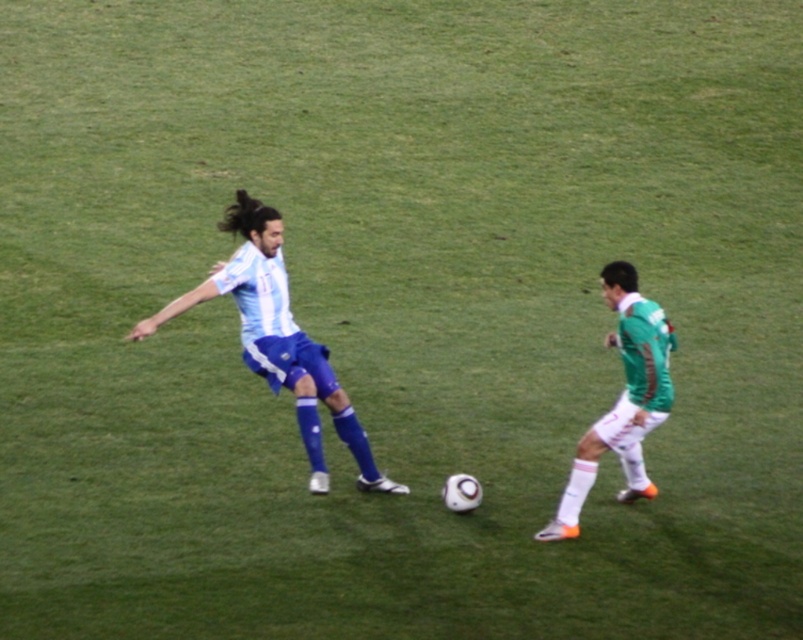
Does white matte soccer ball at center come in front of green matte jersey at right?

No, it is behind green matte jersey at right.

Who is positioned more to the right, white matte soccer ball at center or green matte jersey at right?

Positioned to the right is green matte jersey at right.

What do you see at coordinates (276, 336) in the screenshot? The height and width of the screenshot is (640, 803). I see `white matte soccer ball at center` at bounding box center [276, 336].

You are a GUI agent. You are given a task and a screenshot of the screen. Output one action in this format:
    pyautogui.click(x=<x>, y=<y>)
    Task: Click on the white matte soccer ball at center
    
    Given the screenshot: What is the action you would take?
    pyautogui.click(x=276, y=336)

Which is more to the left, white matte jersey at center or green matte jersey at right?

Positioned to the left is white matte jersey at center.

Where is `white matte jersey at center`? This screenshot has height=640, width=803. white matte jersey at center is located at coordinates (278, 339).

Find the location of `white matte jersey at center`. white matte jersey at center is located at coordinates (278, 339).

Who is positioned more to the left, white matte soccer ball at center or white matte jersey at center?

white matte jersey at center

Is point (251, 266) farther from camera compared to point (390, 490)?

No, it is in front of (390, 490).

Between point (239, 264) and point (333, 392), which one is positioned behind?

The point (239, 264) is more distant.

This screenshot has width=803, height=640. I want to click on white matte soccer ball at center, so click(x=276, y=336).